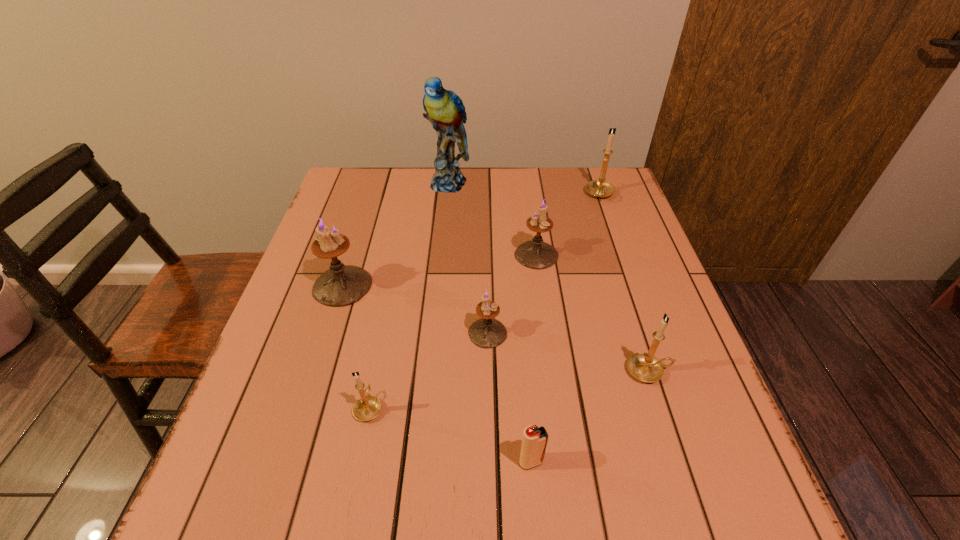
The image size is (960, 540). What are the coordinates of `the leftmost gold candle holder` in the screenshot? It's located at (366, 408).

Identify the location of the fifth candle holder from right to left. The width and height of the screenshot is (960, 540). (366, 408).

Identify the location of the nearest purple candle holder. pyautogui.click(x=487, y=332).

At what (x,y) coordinates should I click in order to perform the action: click on the fourth object from left to right. Please return your answer as a coordinate pair (x, y). The width and height of the screenshot is (960, 540). Looking at the image, I should click on [x=487, y=332].

Identify the location of the nearest object. click(534, 441).

At what (x,y) coordinates should I click in order to perform the action: click on red igniter. Please return your answer as a coordinate pair (x, y). This screenshot has width=960, height=540. Looking at the image, I should click on (534, 441).

At what (x,y) coordinates should I click in order to perform the action: click on free space located on the face of the tallest object. Please return your answer as a coordinate pair (x, y). This screenshot has height=540, width=960. Looking at the image, I should click on (440, 275).

What are the coordinates of `vacant area situated on the handle side of the biggest gold candle holder` in the screenshot? It's located at (637, 303).

The height and width of the screenshot is (540, 960). I want to click on vacant point located 0.270m on the right of the leftmost object, so click(483, 286).

Locate an element on the screen. blank space located 0.400m on the left of the rightmost purple candle holder is located at coordinates (360, 255).